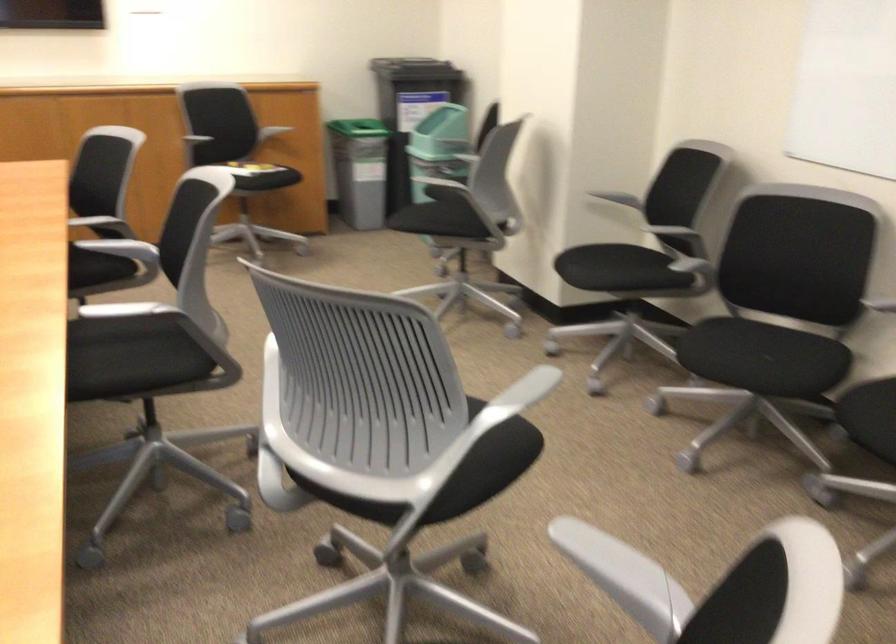
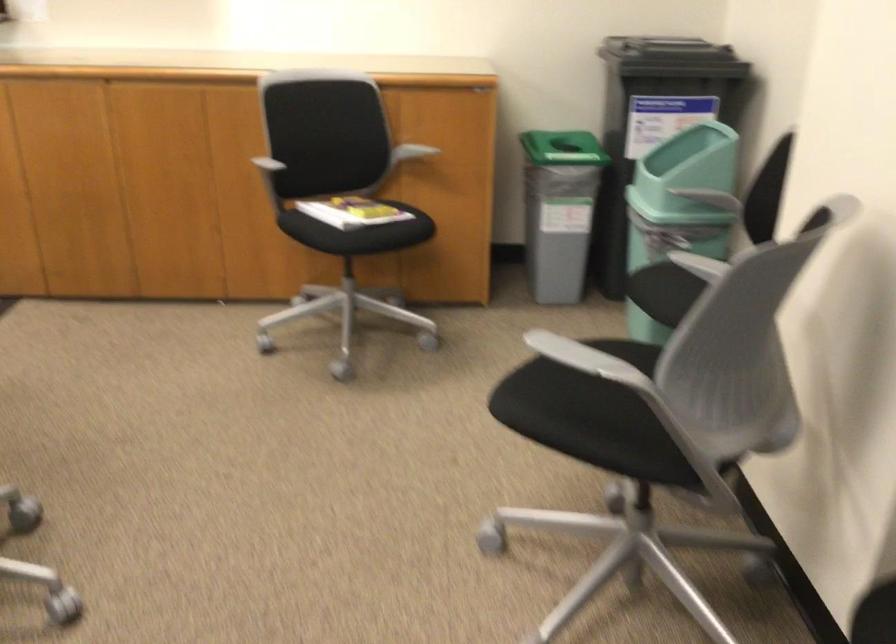
Question: I am providing you with two images of the same scene from different viewpoints. Please identify which objects are invisible in image2.

Choices:
 (A) grey chair armrest
 (B) black bin lid
 (C) chair sitting surface
 (D) none of these

Answer: (D)